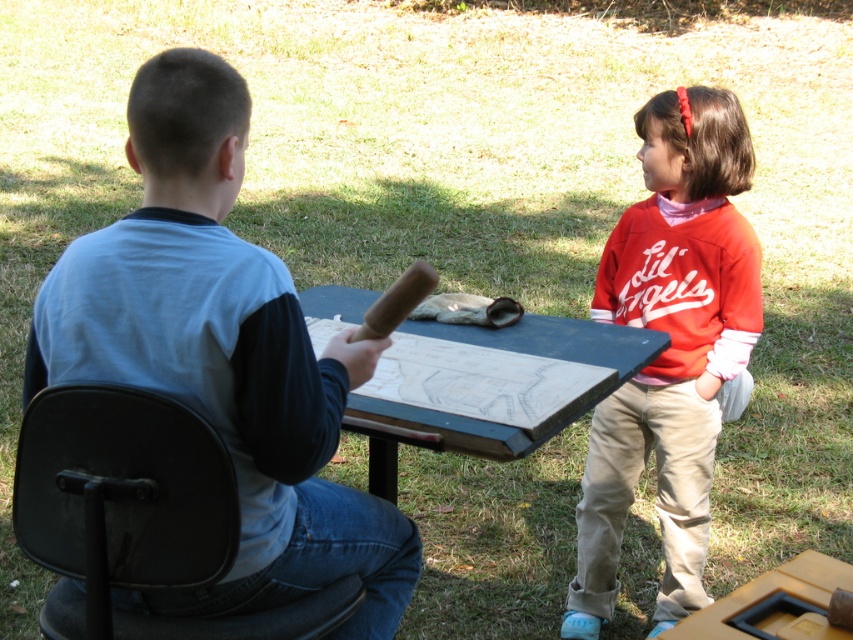
Based on the coordinates provided, what object is located at the point (223, 355) in the scene?

The point (223, 355) indicates the location of the light blue cotton shirt at center.

You are a photographer trying to capture a photo of both the black leather chair at left and the yellow matte picnic table at lower right in the same frame. Based on their positions, which object should you place closer to the camera to ensure both are visible without moving the objects?

The black leather chair at left is positioned on the left side of the yellow matte picnic table at lower right. To include both in the frame, you should position the camera closer to the black leather chair at left since it is farther from the picnic table and thus farther from the camera.